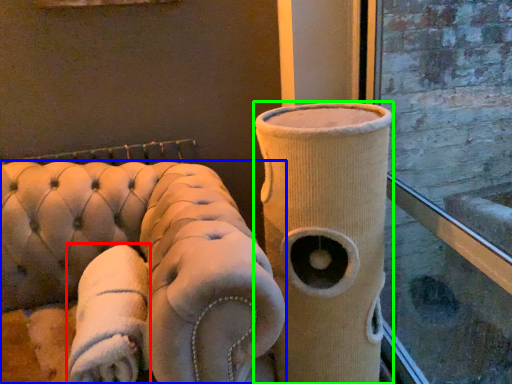
Question: Based on their relative distances, which object is nearer to cloth (highlighted by a red box)? Choose from furniture (highlighted by a blue box) and vase (highlighted by a green box).

Choices:
 (A) furniture
 (B) vase

Answer: (A)